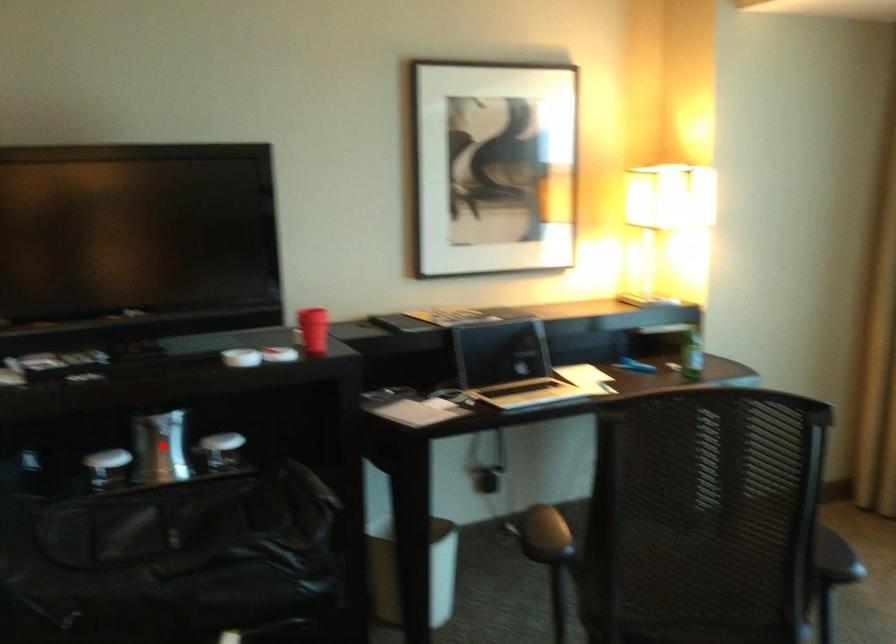
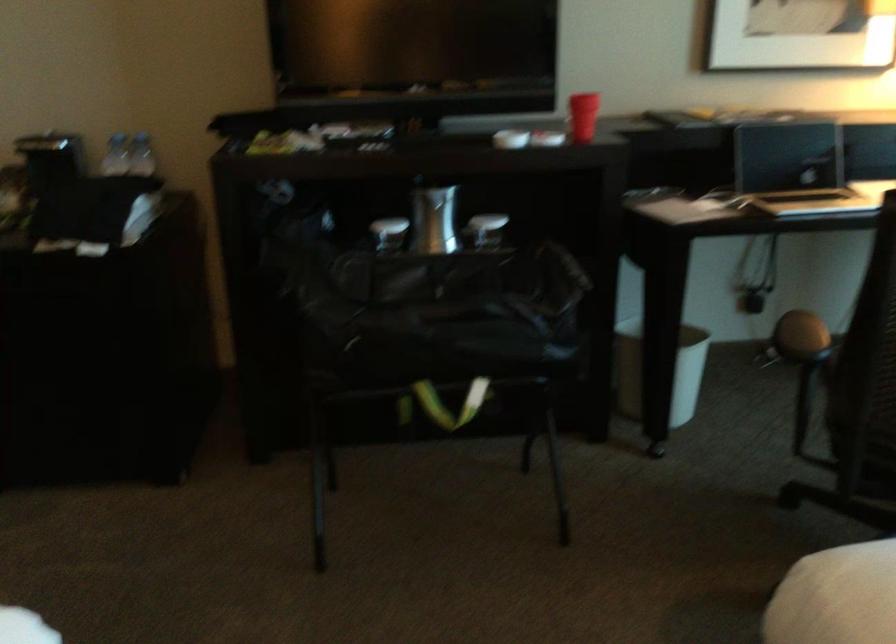
The point at the highlighted location is marked in the first image. Where is the corresponding point in the second image?

(433, 220)